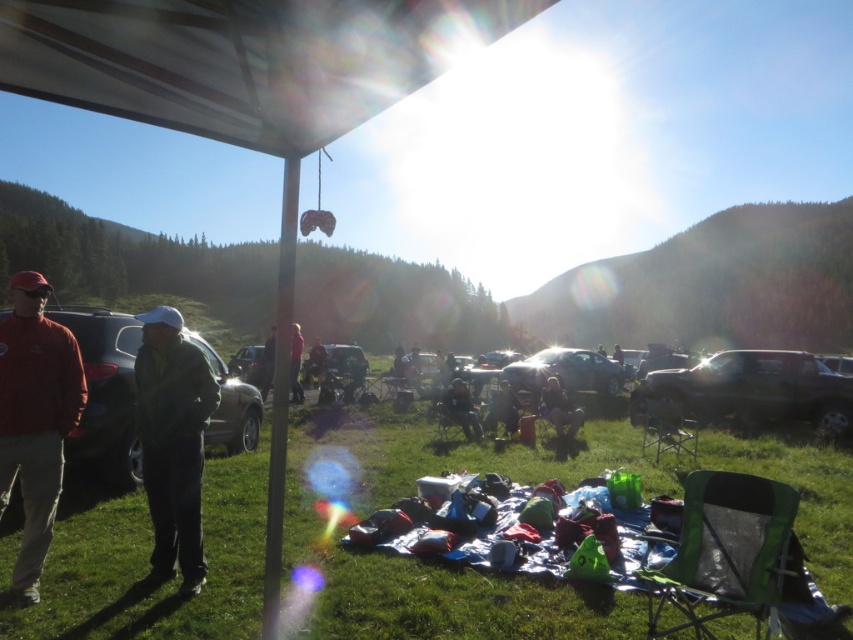
You are organizing a photo shoot and need to ensure that the matte red shirt at left and the metallic silver car at center are both visible in the frame. Given their sizes, which object should you prioritize positioning closer to the camera to maintain visibility?

The matte red shirt at left is smaller than the metallic silver car at center, so you should prioritize positioning the matte red shirt at left closer to the camera to ensure it remains visible in the frame.

You are a photographer standing at the picnic blanket area. You want to take a photo that includes both the matte red shirt at left and the pink fabric at center. Given that your camera has a maximum focus range of 10 meters, will both objects be in focus?

The distance between the matte red shirt at left and the pink fabric at center is 9.98 meters, which is within the camera maximum focus range of 10 meters. Therefore, both objects will be in focus.

You are planning to set up a small tent for shade. The tent requires a clear, flat area that is taller than the surrounding objects. Based on the scene, can the green grass at lower center and the matte black car at left provide a suitable location?

The green grass at lower center has a lesser height compared to the matte black car at left, so the area near the green grass at lower center is shorter than the car. Since the tent needs to be taller than surrounding objects, the green grass at lower center might not be suitable because the matte black car at left is taller and could block the tent. A better spot might be elsewhere where the ground is level and unobstructed by taller items.